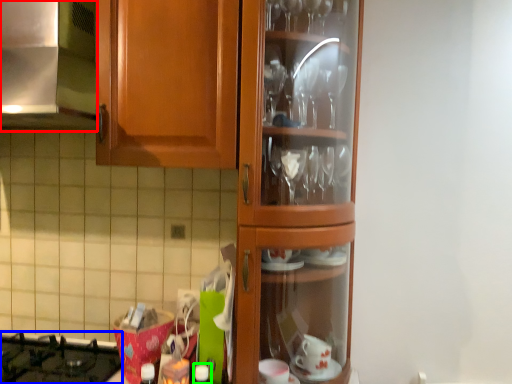
Question: Which is nearer to the exhaust hood (highlighted by a red box)? gas stove (highlighted by a blue box) or bottle (highlighted by a green box).

Choices:
 (A) gas stove
 (B) bottle

Answer: (A)